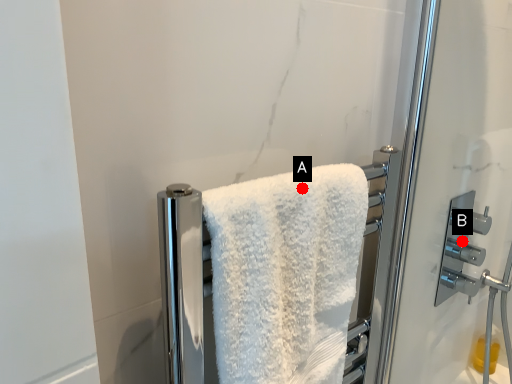
Question: Two points are circled on the image, labeled by A and B beside each circle. Which point appears farthest from the camera in this image?

Choices:
 (A) A is further
 (B) B is further

Answer: (B)